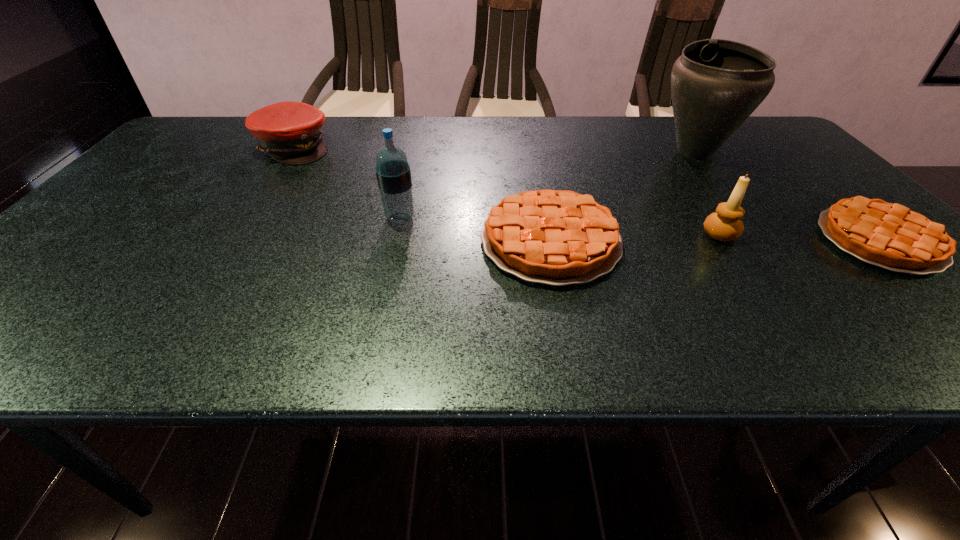
Locate an element on the screen. the fifth tallest object is located at coordinates (558, 238).

The height and width of the screenshot is (540, 960). What are the coordinates of `the taller pie` in the screenshot? It's located at (558, 238).

At what (x,y) coordinates should I click in order to perform the action: click on urn. Please return your answer as a coordinate pair (x, y). The image size is (960, 540). Looking at the image, I should click on (716, 84).

I want to click on the second tallest object, so click(393, 173).

At what (x,y) coordinates should I click in order to perform the action: click on water bottle. Please return your answer as a coordinate pair (x, y). Looking at the image, I should click on (393, 173).

Where is `the leftmost object`? The image size is (960, 540). the leftmost object is located at coordinates (289, 132).

You are a GUI agent. You are given a task and a screenshot of the screen. Output one action in this format:
    pyautogui.click(x=<x>, y=<y>)
    Task: Click on the cap
    
    Given the screenshot: What is the action you would take?
    pyautogui.click(x=289, y=132)

The image size is (960, 540). Identify the location of the fourth shortest object. (725, 224).

This screenshot has width=960, height=540. I want to click on vacant space situated on the left of the taller pie, so click(431, 241).

Identify the location of free space located 0.120m on the left of the urn. The image size is (960, 540). (612, 152).